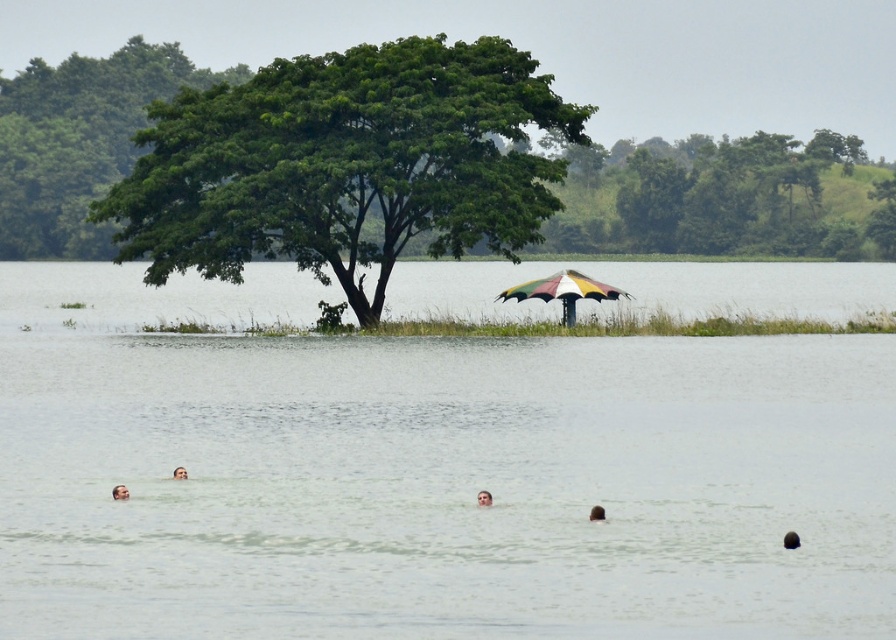
Is clear water at umbrella center positioned behind brown matte head at center?

No.

Is clear water at umbrella center bigger than brown matte head at center?

Yes, clear water at umbrella center is bigger than brown matte head at center.

Is point (501, 476) positioned behind point (588, 515)?

Yes, point (501, 476) is behind point (588, 515).

In order to click on clear water at umbrella center in this screenshot , I will do `click(428, 474)`.

Is green leafy tree at center further to camera compared to brown skin at upper center?

Yes.

Who is lower down, green leafy tree at center or brown skin at upper center?

brown skin at upper center is below.

The height and width of the screenshot is (640, 896). In order to click on green leafy tree at center in this screenshot , I will do `click(345, 163)`.

Between point (593, 518) and point (181, 472), which one is positioned behind?

Point (181, 472)

Find the location of a particular element. brown matte head at center is located at coordinates (596, 513).